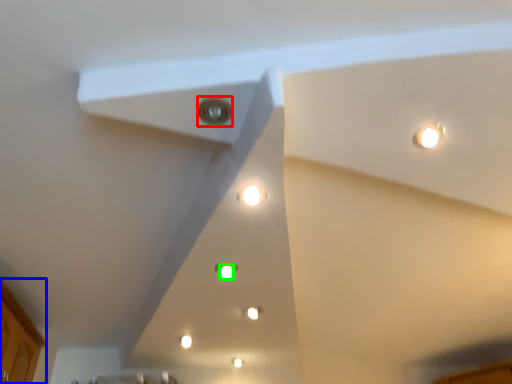
Question: Considering the real-world distances, which object is closest to light (highlighted by a red box)? cabinetry (highlighted by a blue box) or light (highlighted by a green box).

Choices:
 (A) cabinetry
 (B) light

Answer: (B)